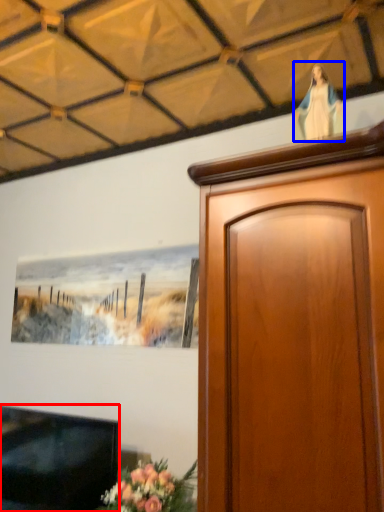
Question: Among these objects, which one is nearest to the camera, television (highlighted by a red box) or woman (highlighted by a blue box)?

Choices:
 (A) television
 (B) woman

Answer: (B)